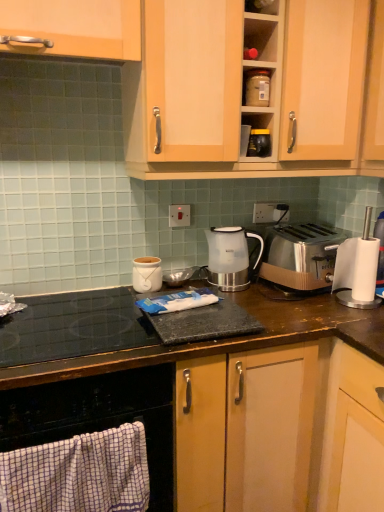
You are a GUI agent. You are given a task and a screenshot of the screen. Output one action in this format:
    pyautogui.click(x=<x>, y=<y>)
    Task: Click on the free spot in front of matte white jar at center, acting as the first kitchen appliance starting from the bottom
    Image resolution: width=384 pixels, height=512 pixels.
    Given the screenshot: What is the action you would take?
    pyautogui.click(x=113, y=307)